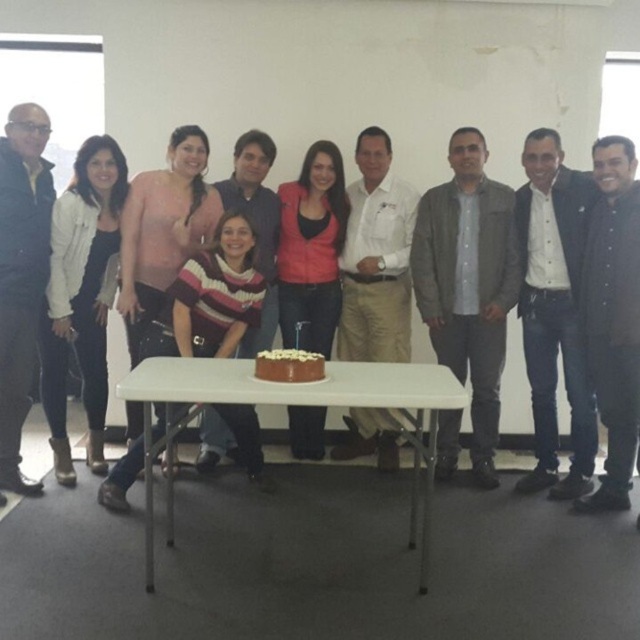
Is light brown leather jacket at center to the left of chocolate frosted cake at center from the viewer's perspective?

Incorrect, light brown leather jacket at center is not on the left side of chocolate frosted cake at center.

Measure the distance between light brown leather jacket at center and camera.

3.37 meters

What do you see at coordinates (554, 310) in the screenshot? I see `light brown leather jacket at center` at bounding box center [554, 310].

Locate an element on the screen. The height and width of the screenshot is (640, 640). light brown leather jacket at center is located at coordinates (554, 310).

Which is behind, point (10, 356) or point (308, 353)?

The point (10, 356) is more distant.

Is matte black jacket at left positioned at the back of chocolate frosted cake at center?

Yes.

Image resolution: width=640 pixels, height=640 pixels. Find the location of `matte black jacket at left`. matte black jacket at left is located at coordinates (20, 275).

You are a GUI agent. You are given a task and a screenshot of the screen. Output one action in this format:
    pyautogui.click(x=<x>, y=<y>)
    Task: Click on the matte black jacket at left
    The image size is (640, 640).
    Given the screenshot: What is the action you would take?
    pyautogui.click(x=20, y=275)

Does matte white jacket at left lie in front of chocolate frosted cake at center?

No, matte white jacket at left is further to the viewer.

Can you confirm if matte white jacket at left is positioned below chocolate frosted cake at center?

Actually, matte white jacket at left is above chocolate frosted cake at center.

Between point (113, 164) and point (312, 358), which one is positioned in front?

Point (312, 358) is more forward.

Locate an element on the screen. This screenshot has height=640, width=640. matte white jacket at left is located at coordinates pyautogui.click(x=81, y=296).